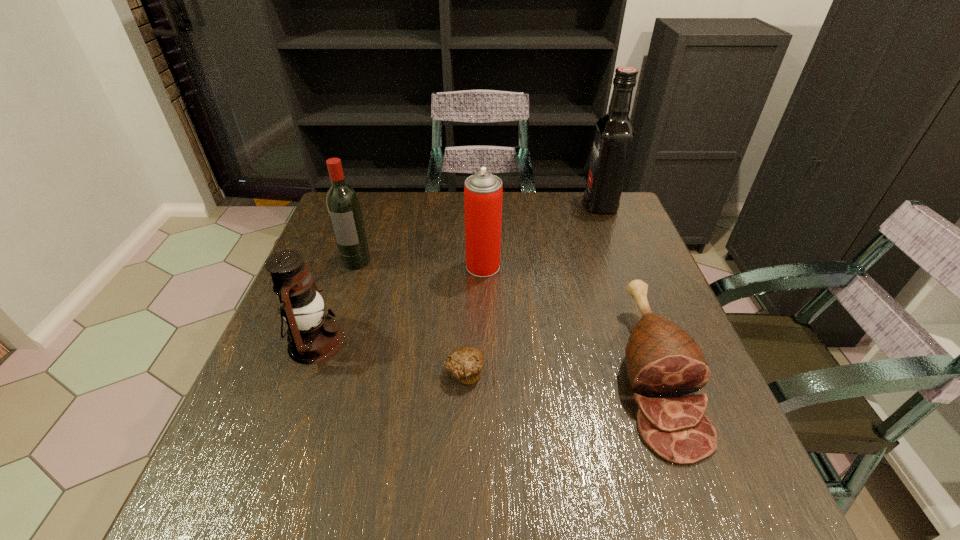
Where is `vacant area that lies between the wine bottle and the lantern`? This screenshot has width=960, height=540. vacant area that lies between the wine bottle and the lantern is located at coordinates coord(336,302).

Locate an element on the screen. The width and height of the screenshot is (960, 540). vacant region between the shortest object and the aerosol can is located at coordinates (473, 319).

Locate an element on the screen. vacant area between the fifth tallest object and the muffin is located at coordinates (559, 373).

Find the location of `vacant area that lies between the wine bottle and the ham`. vacant area that lies between the wine bottle and the ham is located at coordinates (505, 317).

This screenshot has width=960, height=540. I want to click on unoccupied position between the shortest object and the lantern, so click(391, 357).

The width and height of the screenshot is (960, 540). Find the location of `object that stands as the third closest to the ham`. object that stands as the third closest to the ham is located at coordinates [x=614, y=134].

Point out which object is positioned as the second nearest to the aerosol can. Please provide its 2D coordinates. Your answer should be formatted as a tuple, i.e. [(x, y)], where the tuple contains the x and y coordinates of a point satisfying the conditions above.

[(343, 205)]

Find the location of a particular element. vacant space that satisfies the following two spatial constraints: 1. on the label of the muffin; 2. on the left side of the wine bottle is located at coordinates (319, 373).

Where is `free space that satisfies the following two spatial constraints: 1. on the front-facing side of the tallest object; 2. on the front side of the shortest object`? The image size is (960, 540). free space that satisfies the following two spatial constraints: 1. on the front-facing side of the tallest object; 2. on the front side of the shortest object is located at coordinates (664, 373).

At what (x,y) coordinates should I click in order to perform the action: click on vacant region that satisfies the following two spatial constraints: 1. on the label of the wine bottle; 2. on the left side of the shortest object. Please return your answer as a coordinate pair (x, y). Looking at the image, I should click on (319, 373).